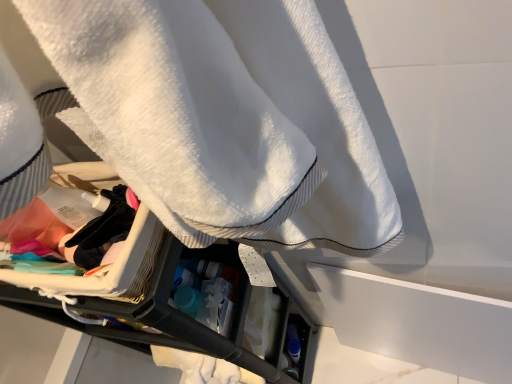
The width and height of the screenshot is (512, 384). What do you see at coordinates (103, 231) in the screenshot?
I see `black fabric at center` at bounding box center [103, 231].

Find the location of a particular element. black fabric at center is located at coordinates (103, 231).

You are a GUI agent. You are given a task and a screenshot of the screen. Output one action in this format:
    pyautogui.click(x=<x>, y=<y>)
    Task: Click on the white terry cloth towel at upper center
    Image resolution: width=512 pixels, height=384 pixels.
    Given the screenshot: What is the action you would take?
    pyautogui.click(x=227, y=118)

The image size is (512, 384). What do you see at coordinates (227, 118) in the screenshot?
I see `white terry cloth towel at upper center` at bounding box center [227, 118].

Measure the distance between white terry cloth towel at upper center and camera.

white terry cloth towel at upper center and camera are 7.56 inches apart from each other.

What are the coordinates of `black fabric at center` in the screenshot? It's located at (103, 231).

Considering the positions of objects white terry cloth towel at upper center and black fabric at center in the image provided, who is more to the left, white terry cloth towel at upper center or black fabric at center?

From the viewer's perspective, black fabric at center appears more on the left side.

Relative to black fabric at center, is white terry cloth towel at upper center in front or behind?

In the image, white terry cloth towel at upper center appears in front of black fabric at center.

Which is less distant, (x=193, y=16) or (x=127, y=217)?

The point (x=193, y=16) is more forward.

From the image's perspective, which one is positioned higher, white terry cloth towel at upper center or black fabric at center?

white terry cloth towel at upper center.

From a real-world perspective, between white terry cloth towel at upper center and black fabric at center, who is vertically lower?

From a 3D spatial view, black fabric at center is below.

From the picture: Considering the sizes of white terry cloth towel at upper center and black fabric at center in the image, is white terry cloth towel at upper center wider or thinner than black fabric at center?

white terry cloth towel at upper center is wider than black fabric at center.

Is white terry cloth towel at upper center taller than black fabric at center?

Indeed, white terry cloth towel at upper center has a greater height compared to black fabric at center.

Can you confirm if white terry cloth towel at upper center is smaller than black fabric at center?

Incorrect, white terry cloth towel at upper center is not smaller in size than black fabric at center.

Can we say white terry cloth towel at upper center lies outside black fabric at center?

Yes, white terry cloth towel at upper center is not within black fabric at center.

Is white terry cloth towel at upper center not near black fabric at center?

Actually, white terry cloth towel at upper center and black fabric at center are a little close together.

Is white terry cloth towel at upper center positioned with its back to black fabric at center?

Yes, white terry cloth towel at upper center's orientation is away from black fabric at center.

How many degrees apart are the facing directions of white terry cloth towel at upper center and black fabric at center?

2.58 degrees.

Locate an element on the screen. towel lying above the black fabric at center (from the image's perspective) is located at coordinates (227, 118).

Is black fabric at center to the left or to the right of white terry cloth towel at upper center in the image?

Clearly, black fabric at center is on the left of white terry cloth towel at upper center in the image.

Considering their positions, is black fabric at center located in front of or behind white terry cloth towel at upper center?

black fabric at center is behind white terry cloth towel at upper center.

Which is in front, point (82, 240) or point (349, 144)?

The point (349, 144) is closer.

From the image's perspective, who appears lower, black fabric at center or white terry cloth towel at upper center?

black fabric at center.

From a real-world perspective, is black fabric at center on white terry cloth towel at upper center?

No, from a real-world perspective, black fabric at center is not over white terry cloth towel at upper center

Between black fabric at center and white terry cloth towel at upper center, which one has smaller width?

black fabric at center.

Considering the relative sizes of black fabric at center and white terry cloth towel at upper center in the image provided, is black fabric at center taller than white terry cloth towel at upper center?

No.

Which of these two, black fabric at center or white terry cloth towel at upper center, is bigger?

With larger size is white terry cloth towel at upper center.

Is black fabric at center not within white terry cloth towel at upper center?

No, black fabric at center is inside white terry cloth towel at upper center's boundary.

Is black fabric at center with white terry cloth towel at upper center?

No, black fabric at center is not in contact with white terry cloth towel at upper center.

Is black fabric at center facing towards white terry cloth towel at upper center?

Yes, black fabric at center is facing white terry cloth towel at upper center.

How different are the orientations of black fabric at center and white terry cloth towel at upper center in degrees?

2.58 degrees separate the facing orientations of black fabric at center and white terry cloth towel at upper center.

Measure the distance between black fabric at center and white terry cloth towel at upper center.

black fabric at center is 9.76 inches away from white terry cloth towel at upper center.

Where is `towel above the black fabric at center (from a real-world perspective)`? towel above the black fabric at center (from a real-world perspective) is located at coordinates (227, 118).

Where is `clothing behind the white terry cloth towel at upper center`? This screenshot has height=384, width=512. clothing behind the white terry cloth towel at upper center is located at coordinates (103, 231).

Locate an element on the screen. towel above the black fabric at center (from the image's perspective) is located at coordinates click(x=227, y=118).